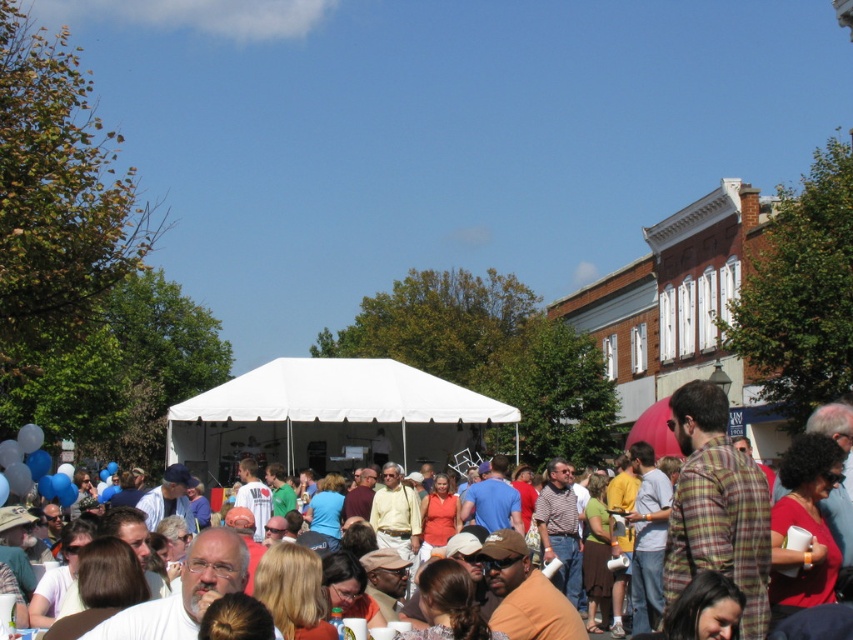
Based on the photo, you are standing at the edge of the event area and want to walk towards the white tent at center. There is a white fabric canopy at center in your path. Which object will you encounter first?

You will encounter the white fabric canopy at center first because it is closer to you than the white tent at center, which is further away.

You are at the outdoor event and want to find shade. You see the white fabric canopy at center and the white tent at center. Which one is above the other?

The white fabric canopy at center is positioned over the white tent at center, so the canopy is above the tent.